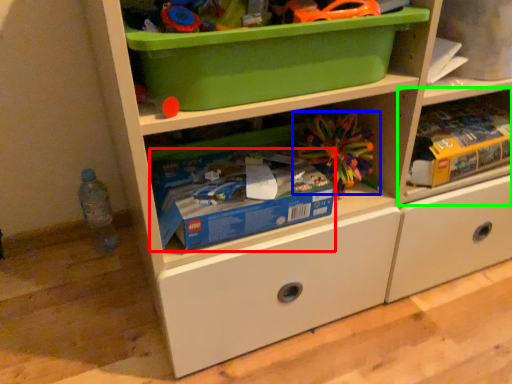
Question: Which object is the farthest from storage box (highlighted by a red box)? Choose among these: toy (highlighted by a blue box) or shelf (highlighted by a green box).

Choices:
 (A) toy
 (B) shelf

Answer: (B)